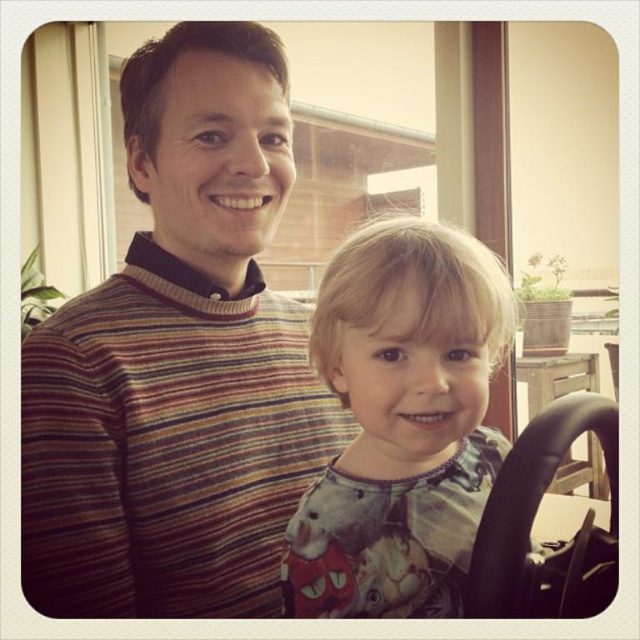
Question: Can you confirm if striped sweater at left is positioned to the right of printed cotton shirt at center?

Choices:
 (A) no
 (B) yes

Answer: (A)

Question: Does striped sweater at left have a lesser width compared to printed cotton shirt at center?

Choices:
 (A) yes
 (B) no

Answer: (B)

Question: Which point appears closest to the camera in this image?

Choices:
 (A) (141, 180)
 (B) (388, 564)

Answer: (B)

Question: Does striped sweater at left come in front of printed cotton shirt at center?

Choices:
 (A) yes
 (B) no

Answer: (B)

Question: Which object appears farthest from the camera in this image?

Choices:
 (A) striped sweater at left
 (B) printed cotton shirt at center

Answer: (A)

Question: Which of the following is the farthest from the observer?

Choices:
 (A) striped sweater at left
 (B) printed cotton shirt at center

Answer: (A)